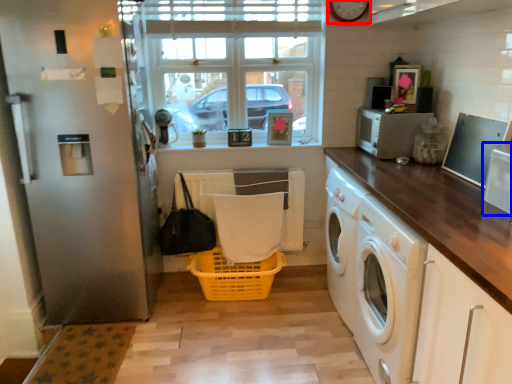
Question: Among these objects, which one is nearest to the camera, clock (highlighted by a red box) or appliance (highlighted by a blue box)?

Choices:
 (A) clock
 (B) appliance

Answer: (B)